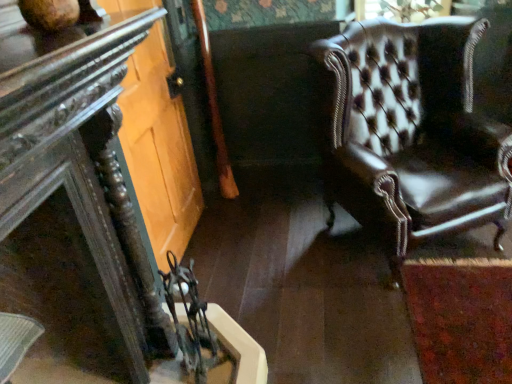
Question: From the image's perspective, does clear glass door at lower left appear higher than dark wood table at left?

Choices:
 (A) no
 (B) yes

Answer: (B)

Question: Can you confirm if clear glass door at lower left is bigger than dark wood table at left?

Choices:
 (A) no
 (B) yes

Answer: (B)

Question: Considering the relative sizes of clear glass door at lower left and dark wood table at left in the image provided, is clear glass door at lower left taller than dark wood table at left?

Choices:
 (A) no
 (B) yes

Answer: (B)

Question: Is clear glass door at lower left facing towards dark wood table at left?

Choices:
 (A) yes
 (B) no

Answer: (B)

Question: Does clear glass door at lower left have a smaller size compared to dark wood table at left?

Choices:
 (A) yes
 (B) no

Answer: (B)

Question: Based on their positions, is clear glass door at lower left located to the left or right of leather armchair at right?

Choices:
 (A) right
 (B) left

Answer: (B)

Question: From the image's perspective, is clear glass door at lower left located above or below leather armchair at right?

Choices:
 (A) above
 (B) below

Answer: (A)

Question: Is clear glass door at lower left spatially inside leather armchair at right, or outside of it?

Choices:
 (A) outside
 (B) inside

Answer: (A)

Question: From a real-world perspective, is clear glass door at lower left above or below leather armchair at right?

Choices:
 (A) above
 (B) below

Answer: (A)

Question: Considering the positions of dark wood table at left and clear glass door at lower left in the image, is dark wood table at left bigger or smaller than clear glass door at lower left?

Choices:
 (A) big
 (B) small

Answer: (B)

Question: In the image, is dark wood table at left positioned in front of or behind clear glass door at lower left?

Choices:
 (A) behind
 (B) front

Answer: (B)

Question: From a real-world perspective, relative to clear glass door at lower left, is dark wood table at left vertically above or below?

Choices:
 (A) above
 (B) below

Answer: (A)

Question: Considering the positions of dark wood table at left and clear glass door at lower left in the image, is dark wood table at left taller or shorter than clear glass door at lower left?

Choices:
 (A) short
 (B) tall

Answer: (A)

Question: From the image's perspective, is clear glass door at lower left positioned above or below dark wood table at left?

Choices:
 (A) above
 (B) below

Answer: (A)

Question: Is clear glass door at lower left situated inside dark wood table at left or outside?

Choices:
 (A) outside
 (B) inside

Answer: (A)